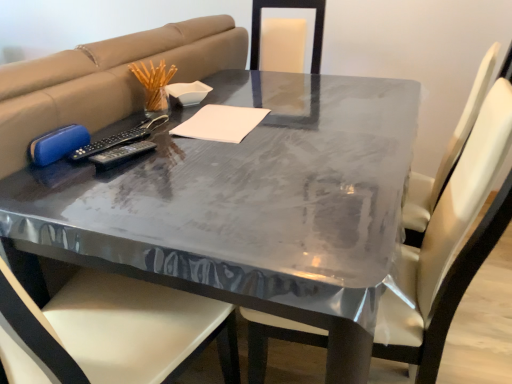
This screenshot has height=384, width=512. What are the coordinates of `white paper at center` in the screenshot? It's located at (221, 123).

Describe the element at coordinates (251, 205) in the screenshot. The width and height of the screenshot is (512, 384). I see `glossy plastic table at center` at that location.

Where is `white leather chair at center`? white leather chair at center is located at coordinates (449, 246).

Which is more to the right, white leather chair at center or glossy plastic table at center?

Positioned to the right is white leather chair at center.

Which object is wider, white leather chair at center or glossy plastic table at center?

Wider between the two is glossy plastic table at center.

How much distance is there between white leather chair at center and glossy plastic table at center?

white leather chair at center is 23.49 centimeters away from glossy plastic table at center.

Is white leather chair at center next to glossy plastic table at center and touching it?

white leather chair at center is not next to glossy plastic table at center, and they're not touching.

Locate an element on the screen. The height and width of the screenshot is (384, 512). notepad lying above the white leather chair at center (from the image's perspective) is located at coordinates (221, 123).

Between white leather chair at center and white paper at center, which one has smaller size?

white paper at center.

In the scene shown: Is white leather chair at center not within white paper at center?

Yes, white leather chair at center is not within white paper at center.

From the image's perspective, which is above, white leather chair at center or white paper at center?

From the image's view, white paper at center is above.

From the image's perspective, between white leather chair at center and black plastic remote at center, which one is located above?

black plastic remote at center.

The height and width of the screenshot is (384, 512). Find the location of `chair in front of the black plastic remote at center`. chair in front of the black plastic remote at center is located at coordinates (449, 246).

From the picture: Can you confirm if white leather chair at center is smaller than black plastic remote at center?

Incorrect, white leather chair at center is not smaller in size than black plastic remote at center.

From a real-world perspective, does white leather chair at center sit lower than black plastic remote at center?

Indeed, from a real-world perspective, white leather chair at center is positioned beneath black plastic remote at center.

Which of these two, white paper at center or black plastic remote at center, is thinner?

With smaller width is black plastic remote at center.

Is white paper at center directly adjacent to black plastic remote at center?

white paper at center and black plastic remote at center are clearly separated.

This screenshot has height=384, width=512. I want to click on remote that is below the white paper at center (from the image's perspective), so click(121, 154).

Consider the image. Does white paper at center have a smaller size compared to black plastic remote at center?

Incorrect, white paper at center is not smaller in size than black plastic remote at center.

Where is `remote above the white paper at center (from a real-world perspective)`? The height and width of the screenshot is (384, 512). remote above the white paper at center (from a real-world perspective) is located at coordinates (121, 154).

From the image's perspective, is black plastic remote at center below white paper at center?

Yes.

In the scene shown: Does black plastic remote at center turn towards white paper at center?

No, black plastic remote at center does not turn towards white paper at center.

Is black plastic remote at center in front of or behind white leather chair at center in the image?

black plastic remote at center is positioned farther from the viewer than white leather chair at center.

From the image's perspective, which one is positioned higher, black plastic remote at center or white leather chair at center?

black plastic remote at center.

Which is more distant, (90, 157) or (421, 304)?

The point (90, 157) is farther from the camera.

Is black plastic remote at center inside the boundaries of white leather chair at center, or outside?

black plastic remote at center cannot be found inside white leather chair at center.

Is glossy plastic table at center aimed at black plastic remote at center?

No, glossy plastic table at center is not turned towards black plastic remote at center.

Considering the positions of objects glossy plastic table at center and black plastic remote at center in the image provided, who is in front, glossy plastic table at center or black plastic remote at center?

glossy plastic table at center is closer to the camera.

Measure the distance between glossy plastic table at center and black plastic remote at center.

They are 14.16 inches apart.

Find the location of a particular element. This screenshot has height=384, width=512. chair lying below the glossy plastic table at center (from the image's perspective) is located at coordinates (449, 246).

You are a GUI agent. You are given a task and a screenshot of the screen. Output one action in this format:
    pyautogui.click(x=<x>, y=<y>)
    Task: Click on the chair directly beneath the white paper at center (from a real-world perspective)
    
    Given the screenshot: What is the action you would take?
    pyautogui.click(x=449, y=246)

Considering their positions, is black plastic remote at center positioned further to white paper at center than glossy plastic table at center?

glossy plastic table at center.

Based on their spatial positions, is black plastic remote at center or white paper at center closer to white leather chair at center?

white paper at center is closer to white leather chair at center.

Looking at the image, which one is located further to glossy plastic table at center, white leather chair at center or black plastic remote at center?

The object further to glossy plastic table at center is black plastic remote at center.

Estimate the real-world distances between objects in this image. Which object is closer to black plastic remote at center, white leather chair at center or glossy plastic table at center?

glossy plastic table at center lies closer to black plastic remote at center than the other object.

Based on their spatial positions, is white leather chair at center or white paper at center closer to black plastic remote at center?

white paper at center.

In the scene shown: From the image, which object appears to be nearer to white leather chair at center, black plastic remote at center or glossy plastic table at center?

Among the two, glossy plastic table at center is located nearer to white leather chair at center.

Looking at the image, which one is located closer to white leather chair at center, glossy plastic table at center or black plastic remote at center?

glossy plastic table at center is closer to white leather chair at center.

Which object lies further to the anchor point black plastic remote at center, white paper at center or white leather chair at center?

The object further to black plastic remote at center is white leather chair at center.

The width and height of the screenshot is (512, 384). What are the coordinates of `remote between white leather chair at center and white paper at center along the z-axis` in the screenshot? It's located at (121, 154).

This screenshot has height=384, width=512. Find the location of `table situated between black plastic remote at center and white leather chair at center from left to right`. table situated between black plastic remote at center and white leather chair at center from left to right is located at coordinates (251, 205).

Identify the location of table located between white leather chair at center and white paper at center in the depth direction. (251, 205).

This screenshot has height=384, width=512. Identify the location of remote between glossy plastic table at center and white paper at center along the z-axis. (121, 154).